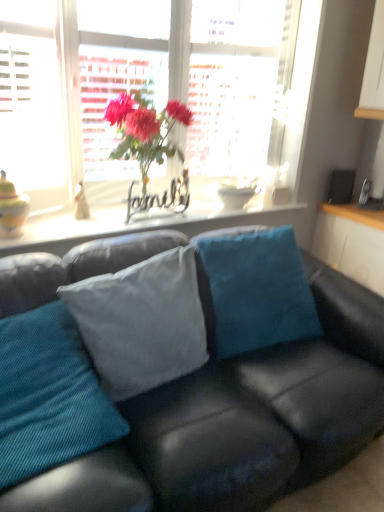
Find the location of a particular element. This screenshot has width=384, height=512. vacant area that is situated to the right of matte yellow vase at left is located at coordinates (62, 231).